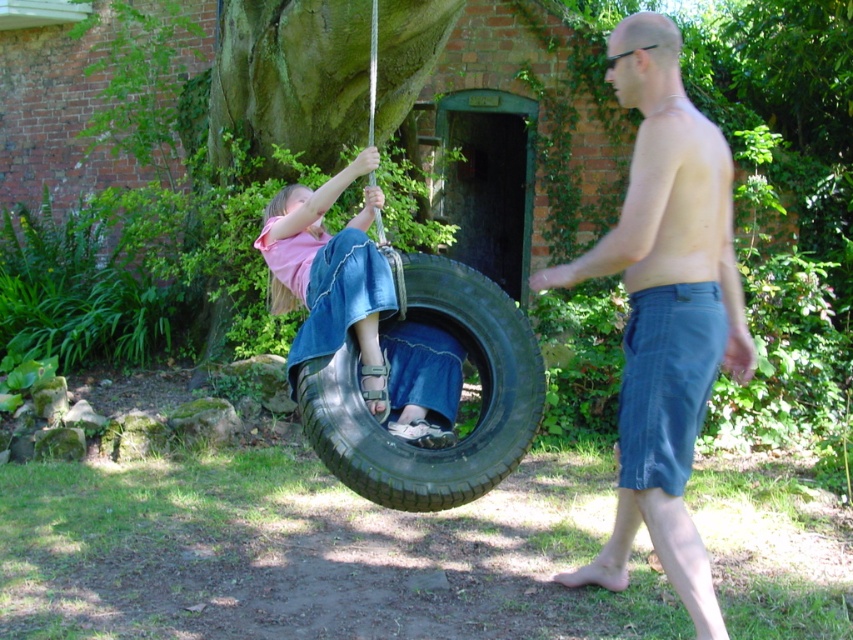
Does blue denim shorts at right have a smaller size compared to denim skirt at center?

Actually, blue denim shorts at right might be larger than denim skirt at center.

Consider the image. Which is more to the right, blue denim shorts at right or denim skirt at center?

From the viewer's perspective, blue denim shorts at right appears more on the right side.

Where is `blue denim shorts at right`? This screenshot has height=640, width=853. blue denim shorts at right is located at coordinates (665, 310).

Does point (486, 332) lie in front of point (360, 364)?

No.

Who is more forward, (323, 358) or (350, 296)?

Point (323, 358) is in front.

Which is in front, point (407, 300) or point (369, 259)?

Positioned in front is point (369, 259).

In order to click on black rubber tire at center in this screenshot , I will do `click(479, 394)`.

Can you confirm if blue denim shorts at right is positioned to the left of black rubber tire at center?

In fact, blue denim shorts at right is to the right of black rubber tire at center.

Which is in front, point (653, 360) or point (445, 300)?

Point (653, 360) is in front.

Image resolution: width=853 pixels, height=640 pixels. In order to click on blue denim shorts at right in this screenshot , I will do `click(665, 310)`.